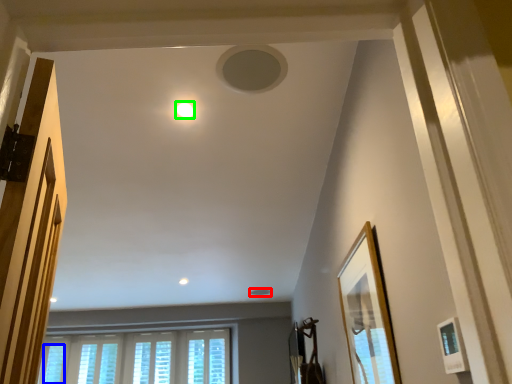
Question: Which object is positioned farthest from hole (highlighted by a red box)? Select from window (highlighted by a blue box) and lighting (highlighted by a green box).

Choices:
 (A) window
 (B) lighting

Answer: (B)